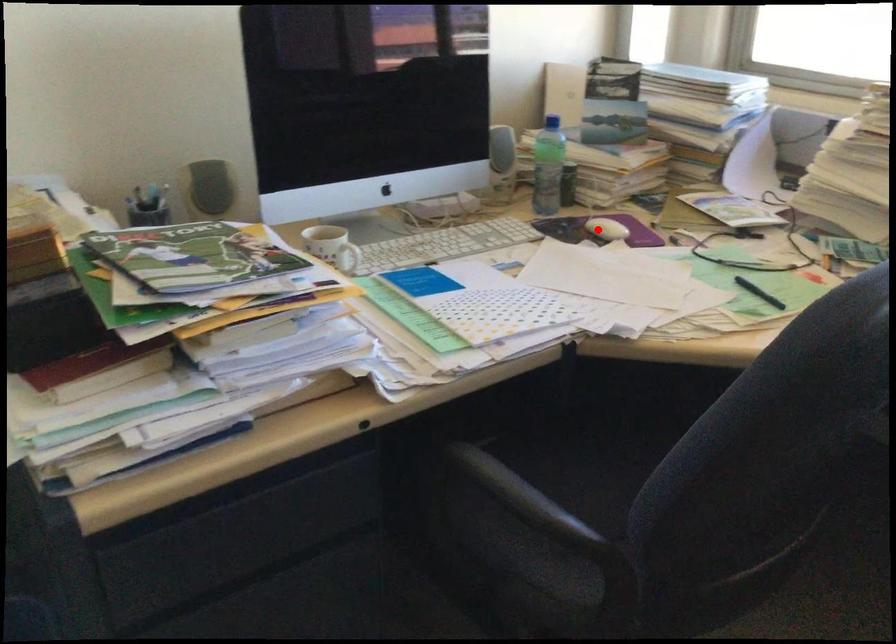
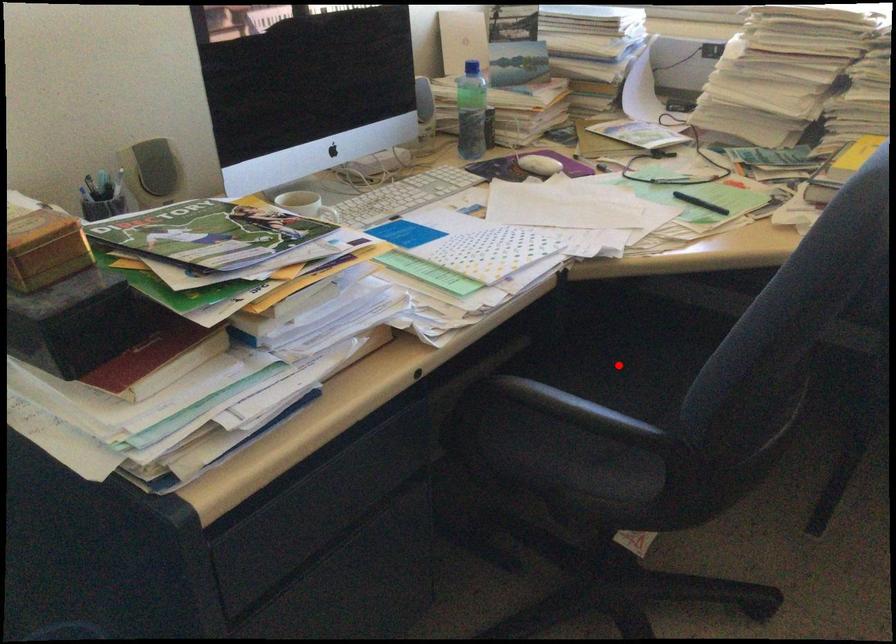
I am providing you with two images of the same scene from different viewpoints. A red point is marked on the first image and another point is marked on the second image. Is the marked point in image1 the same physical position as the marked point in image2?

No